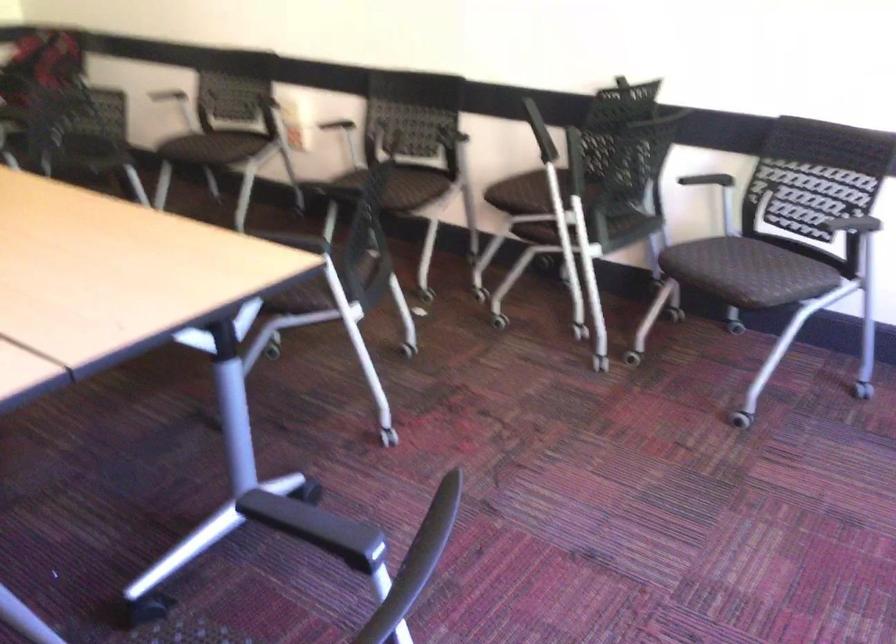
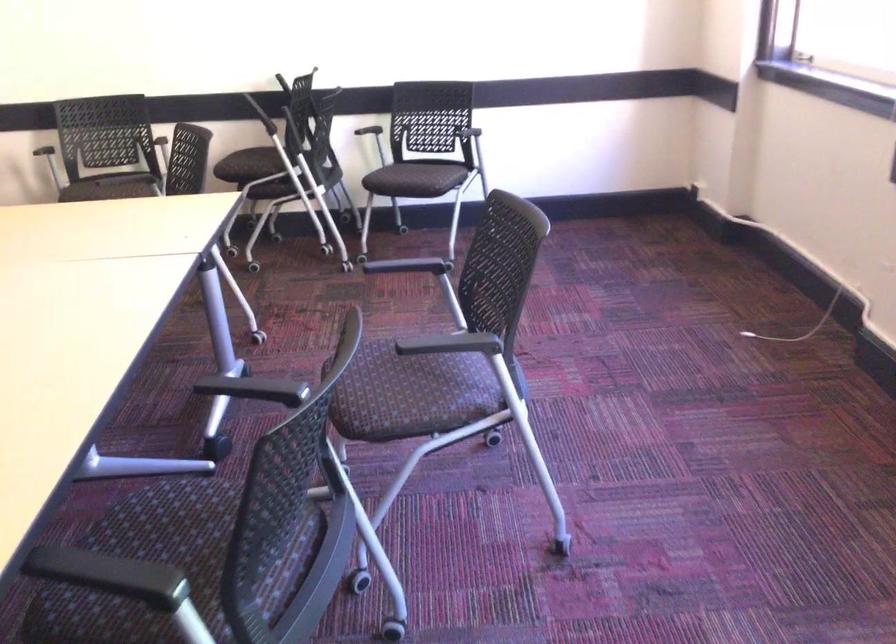
Find the pixel in the second image that matches [349,113] in the first image.

(30, 140)